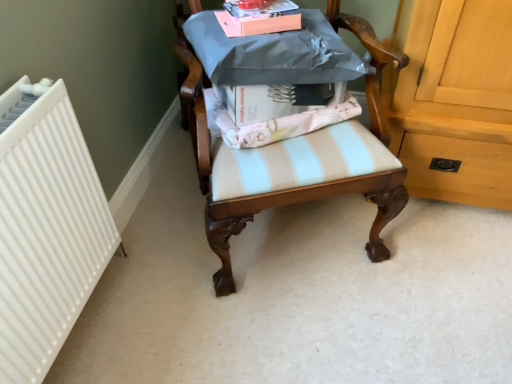
Locate an element on the screen. The height and width of the screenshot is (384, 512). free space underneath wooden chair at center (from a real-world perspective) is located at coordinates (295, 236).